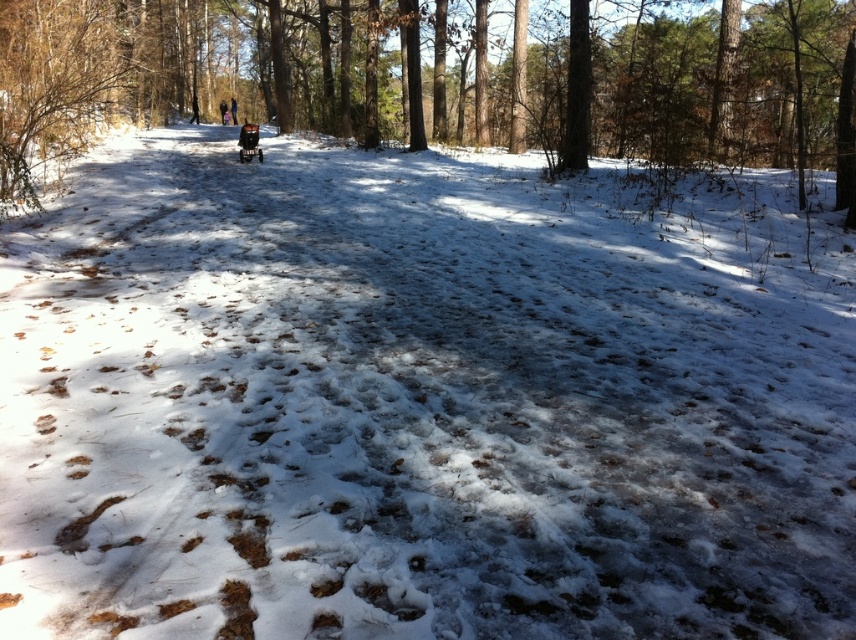
Can you confirm if brown textured tree at center is smaller than black fabric stroller at center?

No.

Does point (560, 29) come farther from viewer compared to point (232, 115)?

No, (560, 29) is closer to viewer.

You are a GUI agent. You are given a task and a screenshot of the screen. Output one action in this format:
    pyautogui.click(x=<x>, y=<y>)
    Task: Click on the brown textured tree at center
    
    Given the screenshot: What is the action you would take?
    pyautogui.click(x=438, y=80)

Does brown textured tree at center have a lesser height compared to black fabric person at upper center?

No.

Can you confirm if brown textured tree at center is wider than black fabric person at upper center?

Yes.

Locate an element on the screen. brown textured tree at center is located at coordinates (438, 80).

Is black fabric person at upper center in front of black fabric stroller at center?

No, black fabric person at upper center is further to the viewer.

Who is more distant from viewer, (221,109) or (235,116)?

The point (221,109) is behind.

Where is `black fabric person at upper center`? black fabric person at upper center is located at coordinates (223, 113).